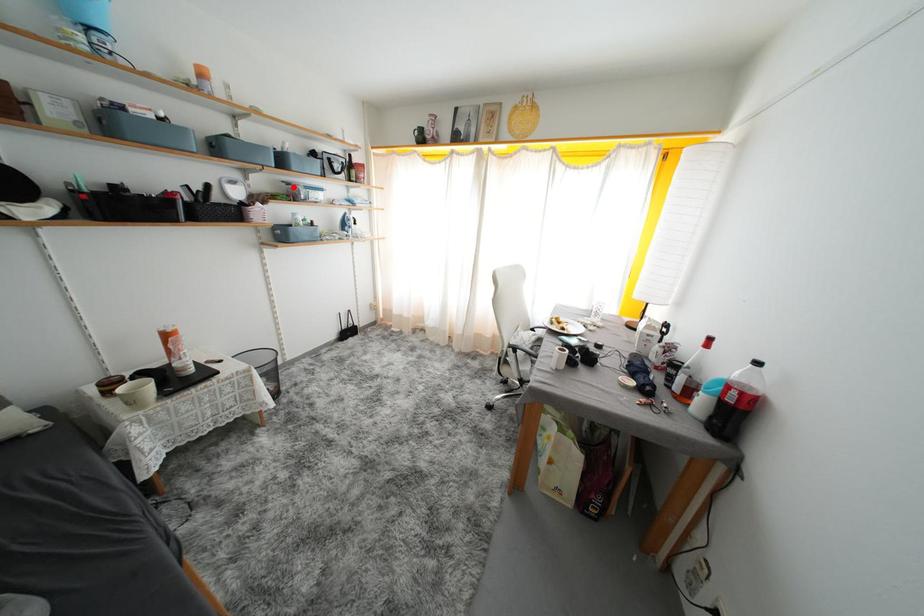
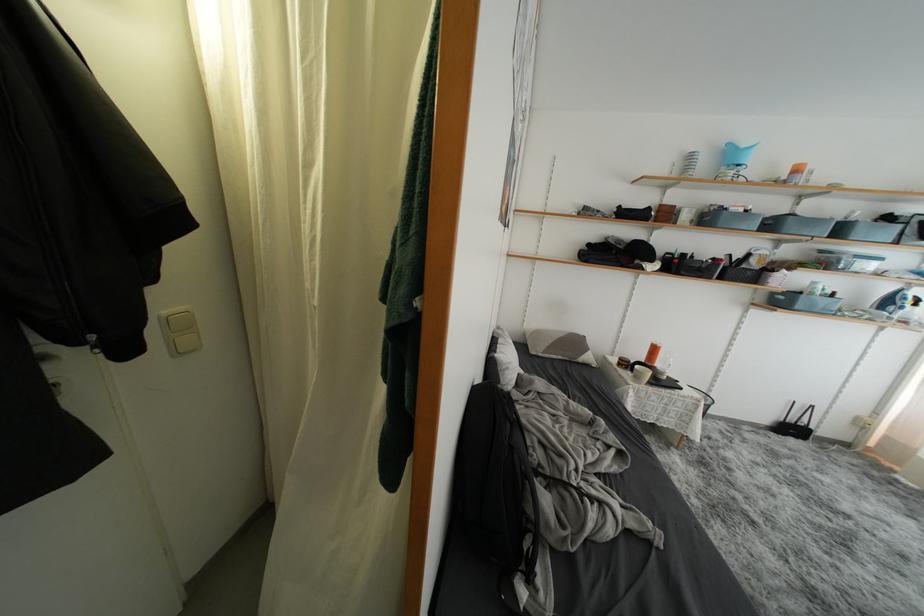
The point at the highlighted location is marked in the first image. Where is the corresponding point in the second image?

(829, 256)